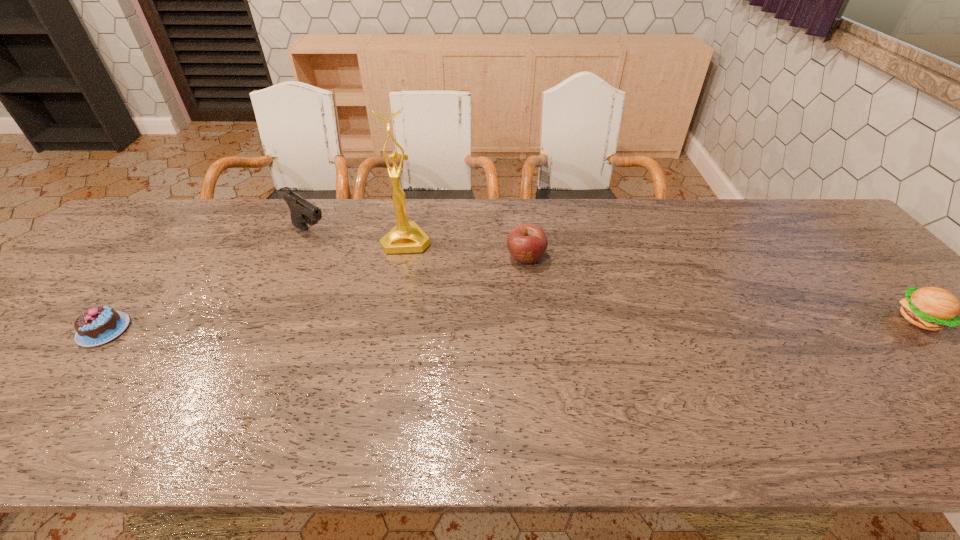
Find the location of a particular element. The image size is (960, 540). vacant space on the desktop that is between the shortest object and the rightmost object and is positioned on the side of the apple with the unique marking is located at coordinates (482, 325).

At what (x,y) coordinates should I click in order to perform the action: click on free space on the desktop that is between the leftmost object and the rightmost object and is positioned on the front-facing side of the third object from left to right. Please return your answer as a coordinate pair (x, y). Image resolution: width=960 pixels, height=540 pixels. Looking at the image, I should click on (408, 326).

At what (x,y) coordinates should I click in order to perform the action: click on vacant space on the desktop that is between the shortest object and the hamburger and is positioned at the barrel of the fourth object from right to left. Please return your answer as a coordinate pair (x, y). This screenshot has height=540, width=960. Looking at the image, I should click on (446, 326).